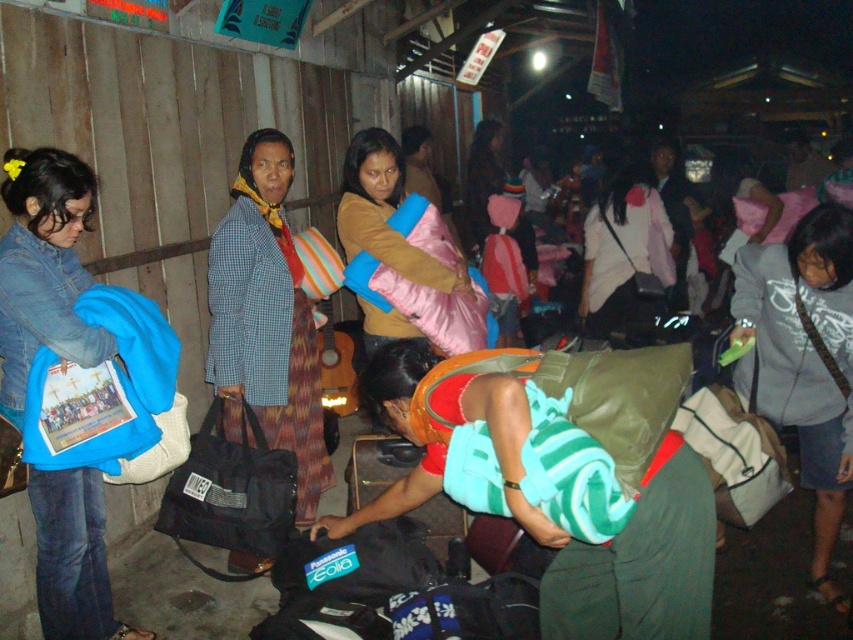
Measure the distance between gray cotton hoodie at lower right and camera.

A distance of 2.76 meters exists between gray cotton hoodie at lower right and camera.

Can you confirm if gray cotton hoodie at lower right is positioned to the right of white fabric bag at lower right?

Indeed, gray cotton hoodie at lower right is positioned on the right side of white fabric bag at lower right.

Which is behind, point (840, 237) or point (733, 506)?

The point (733, 506) is more distant.

At what (x,y) coordinates should I click in order to perform the action: click on gray cotton hoodie at lower right. Please return your answer as a coordinate pair (x, y). The height and width of the screenshot is (640, 853). Looking at the image, I should click on (804, 358).

Can you confirm if black fabric bag at lower left is positioned below white fabric bag at lower right?

Yes.

What do you see at coordinates (230, 492) in the screenshot? This screenshot has height=640, width=853. I see `black fabric bag at lower left` at bounding box center [230, 492].

What do you see at coordinates (230, 492) in the screenshot?
I see `black fabric bag at lower left` at bounding box center [230, 492].

Locate an element on the screen. The height and width of the screenshot is (640, 853). black fabric bag at lower left is located at coordinates (230, 492).

Which is more to the left, gray cotton hoodie at lower right or checkered fabric jacket at center?

checkered fabric jacket at center

Does gray cotton hoodie at lower right have a greater height compared to checkered fabric jacket at center?

No, gray cotton hoodie at lower right is not taller than checkered fabric jacket at center.

I want to click on gray cotton hoodie at lower right, so click(x=804, y=358).

I want to click on gray cotton hoodie at lower right, so click(804, 358).